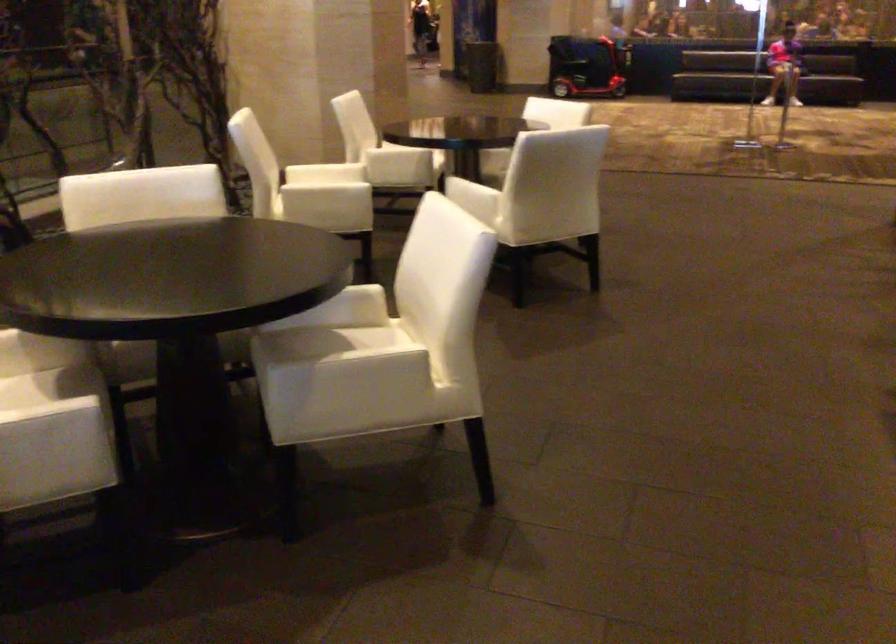
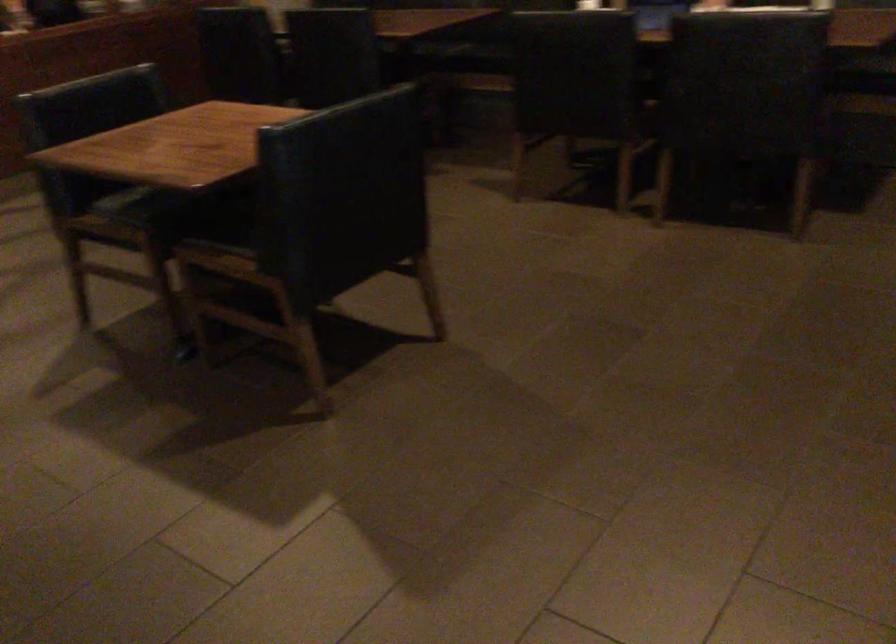
The images are taken continuously from a first-person perspective. In which direction is your viewpoint rotating?

The camera rotated toward right-down.